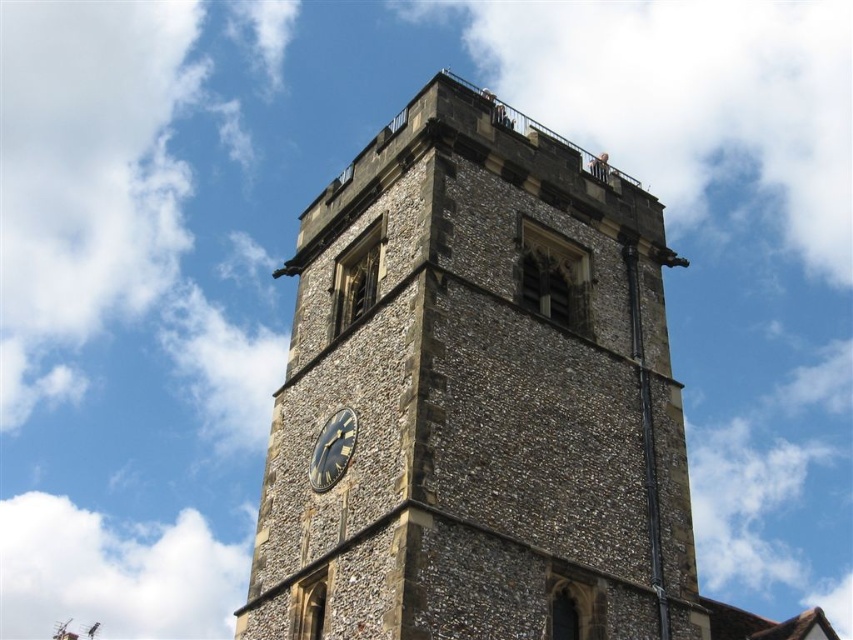
Question: From the image, what is the correct spatial relationship of brown stone clock tower at upper center in relation to black stone clock at center?

Choices:
 (A) above
 (B) below

Answer: (A)

Question: Which point is closer to the camera taking this photo?

Choices:
 (A) (323, 429)
 (B) (561, 563)

Answer: (B)

Question: Is brown stone clock tower at upper center closer to the viewer compared to black stone clock at center?

Choices:
 (A) no
 (B) yes

Answer: (B)

Question: Does brown stone clock tower at upper center have a larger size compared to black stone clock at center?

Choices:
 (A) yes
 (B) no

Answer: (A)